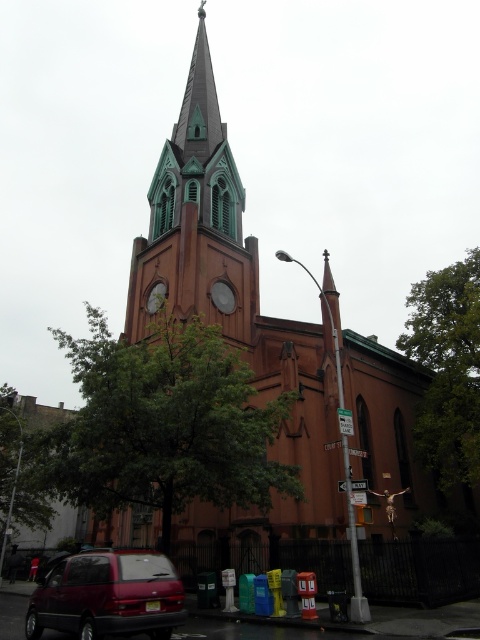
Does green leafy tree at right appear on the right side of matte red minivan at lower left?

Yes, green leafy tree at right is to the right of matte red minivan at lower left.

Which of these two, green leafy tree at right or matte red minivan at lower left, stands taller?

green leafy tree at right is taller.

Identify the location of green leafy tree at right. The width and height of the screenshot is (480, 640). coord(447,369).

Find the location of a particular element. green leafy tree at right is located at coordinates (447, 369).

Locate an element on the screen. The height and width of the screenshot is (640, 480). green leafy tree at center is located at coordinates (160, 426).

The width and height of the screenshot is (480, 640). I want to click on green leafy tree at center, so click(x=160, y=426).

Identify the location of green leafy tree at center. (160, 426).

Is point (103, 349) positioned behind point (107, 611)?

Yes, it is.

Between green leafy tree at center and matte red minivan at lower left, which one appears on the left side from the viewer's perspective?

green leafy tree at center

Where is `green leafy tree at center`? The width and height of the screenshot is (480, 640). green leafy tree at center is located at coordinates (160, 426).